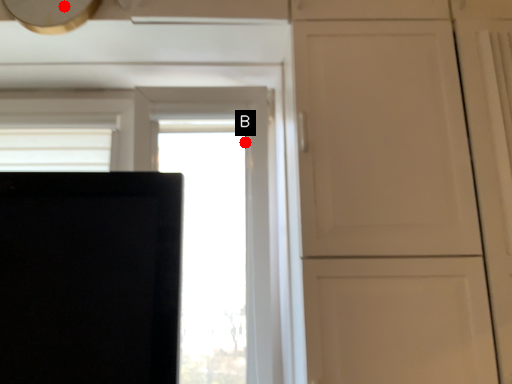
Question: Two points are circled on the image, labeled by A and B beside each circle. Which point appears farthest from the camera in this image?

Choices:
 (A) A is further
 (B) B is further

Answer: (B)